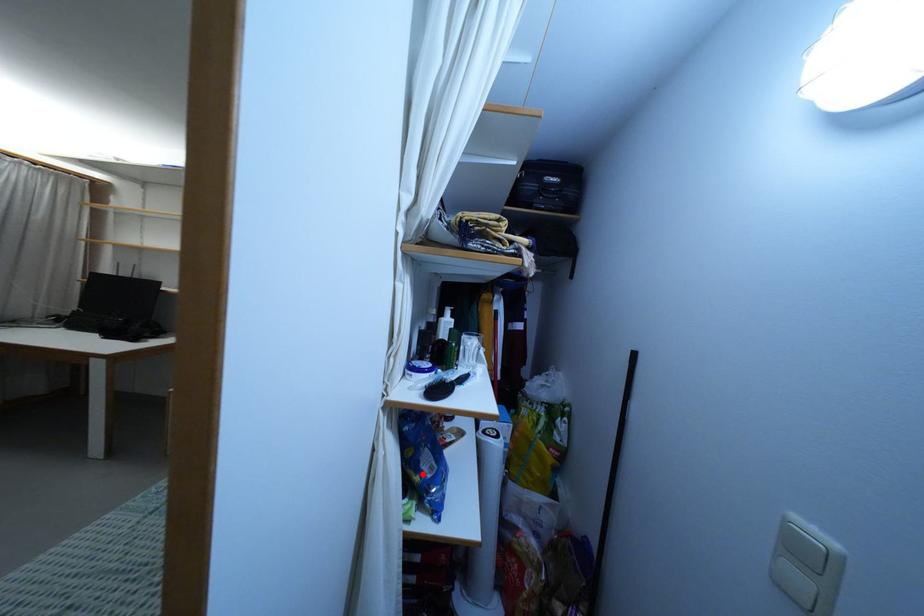
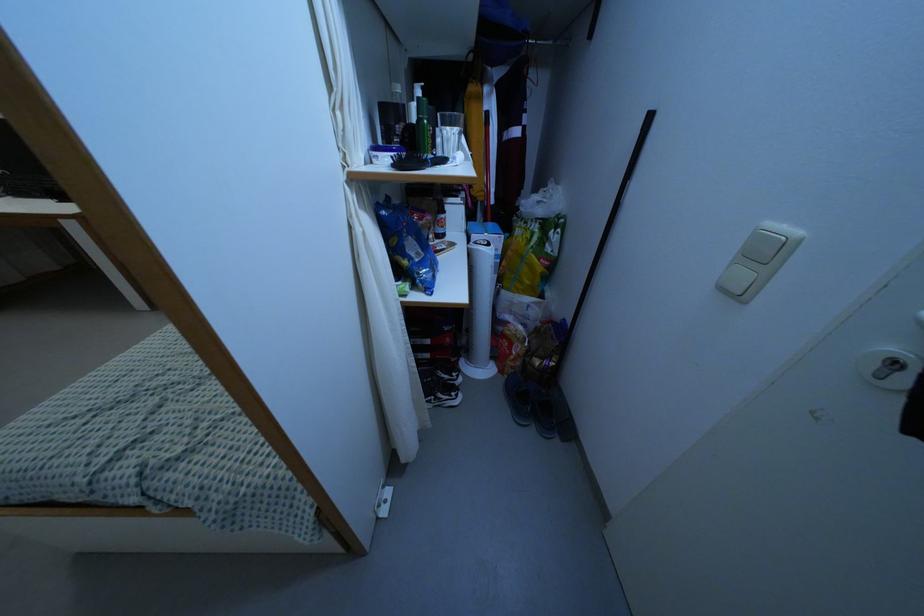
Where in the second image is the point corresponding to the highlighted location from the first image?

(409, 257)